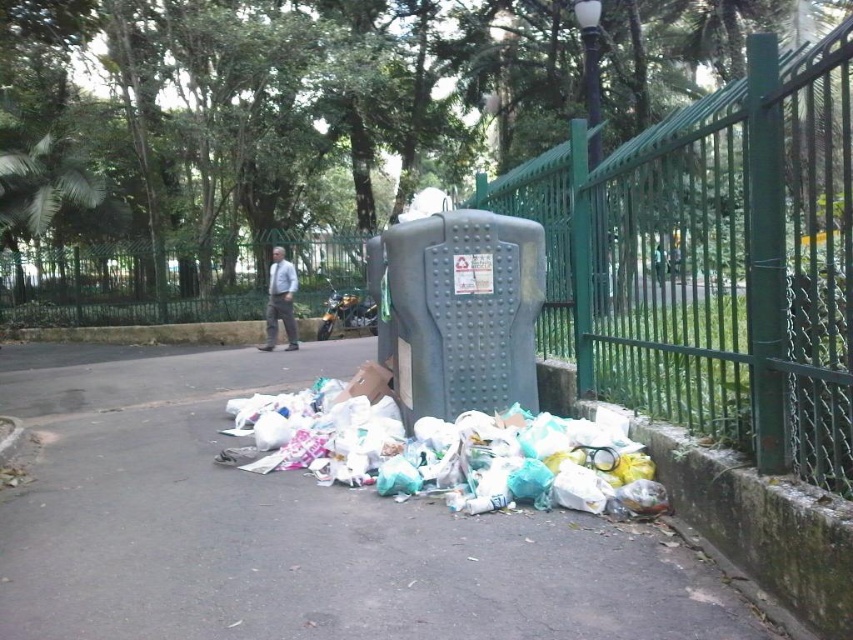
You are a park maintenance worker who needs to clean up the plastic bags at lower center and the green metal fence at center. Which object requires more effort to clean due to its size?

The green metal fence at center requires more effort to clean because it is larger than the plastic bags at lower center.

Consider the image. You are standing at the point marked by the coordinates (x=132, y=284) in the image. What object is located at that exact position?

The green metal fence at center is located at the coordinates (x=132, y=284).

Consider the image. You are a park maintenance worker who needs to secure the plastic bags at lower center and the green metal fence at center. According to the scene, which object is located to the right of the other?

The plastic bags at lower center is positioned on the right side of green metal fence at center.